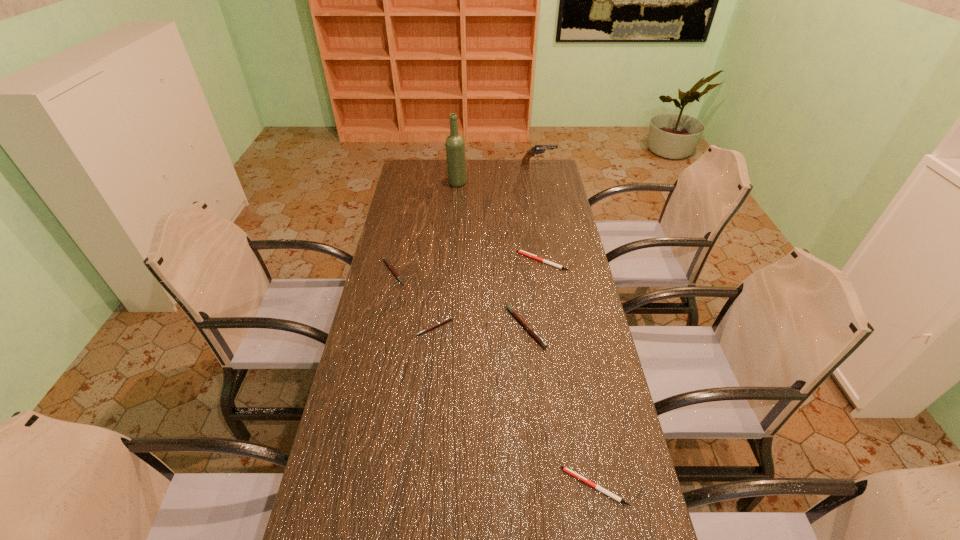
At what (x,y) coordinates should I click in order to perform the action: click on the smallest pink pen. Please return your answer as a coordinate pair (x, y). Looking at the image, I should click on (450, 318).

Where is `the nearest pen`? the nearest pen is located at coordinates pyautogui.click(x=619, y=499).

You are a GUI agent. You are given a task and a screenshot of the screen. Output one action in this format:
    pyautogui.click(x=<x>, y=<y>)
    Task: Click on the nearest object
    The height and width of the screenshot is (540, 960).
    Given the screenshot: What is the action you would take?
    pyautogui.click(x=619, y=499)

The image size is (960, 540). What are the coordinates of `vacant space located on the right of the wine bottle` in the screenshot? It's located at (536, 183).

This screenshot has height=540, width=960. Identify the location of vacant position located at the nib of the tallest pen. (463, 326).

I want to click on free space located 0.100m at the nib of the tallest pen, so click(475, 326).

Locate an element on the screen. This screenshot has height=540, width=960. vacant space located 0.080m at the nib of the tallest pen is located at coordinates (481, 326).

At what (x,y) coordinates should I click in order to perform the action: click on free region located at the nib of the leftmost pen. Please return your answer as a coordinate pair (x, y). The height and width of the screenshot is (540, 960). Looking at the image, I should click on (426, 272).

At what (x,y) coordinates should I click in order to perform the action: click on free space located on the clicker of the bigger white pen. Please return your answer as a coordinate pair (x, y). Looking at the image, I should click on (491, 261).

Where is `free space located 0.210m on the clicker of the bigger white pen`? The image size is (960, 540). free space located 0.210m on the clicker of the bigger white pen is located at coordinates (462, 261).